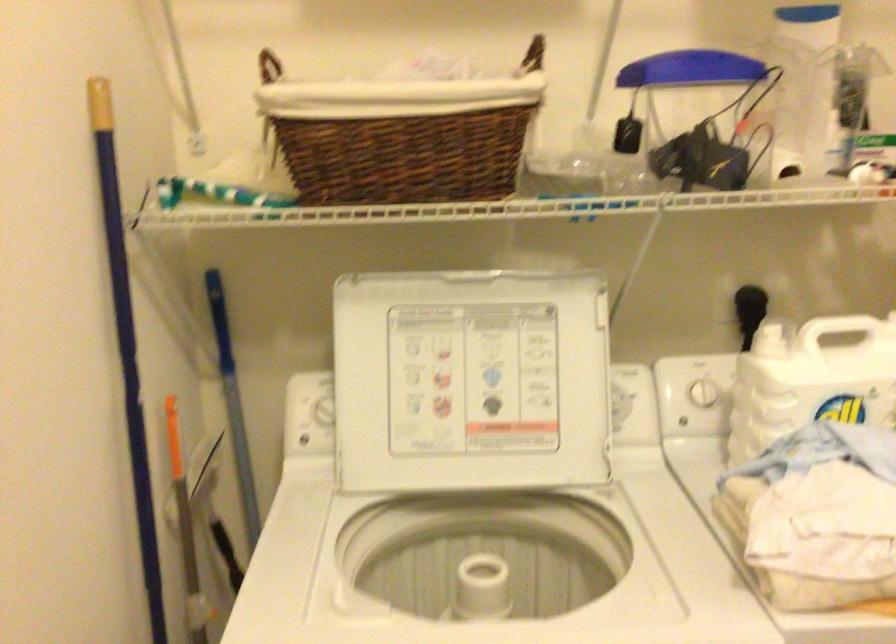
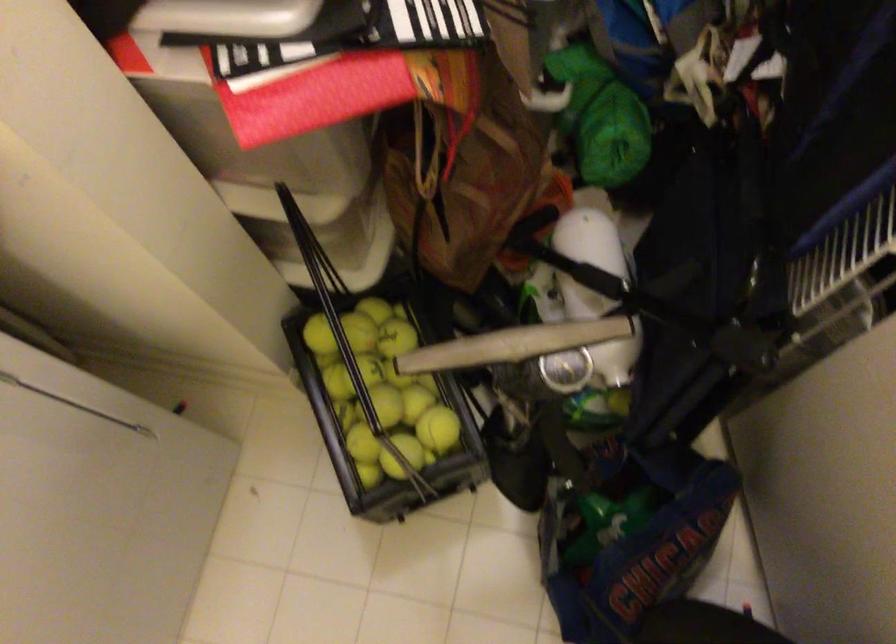
From the picture: How did the camera likely rotate?

The rotation direction of the camera is right-down.